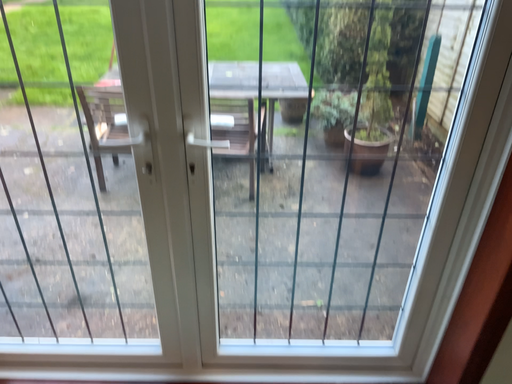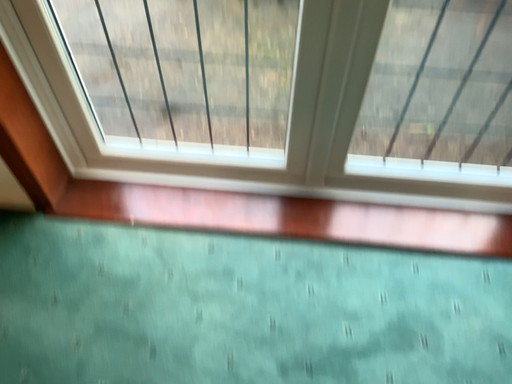
Question: How did the camera likely rotate when shooting the video?

Choices:
 (A) rotated downward
 (B) rotated upward

Answer: (A)